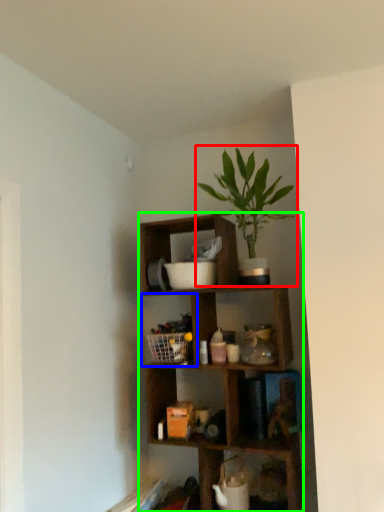
Question: Which object is positioned farthest from houseplant (highlighted by a red box)? Select from cabinet (highlighted by a blue box) and shelf (highlighted by a green box).

Choices:
 (A) cabinet
 (B) shelf

Answer: (A)